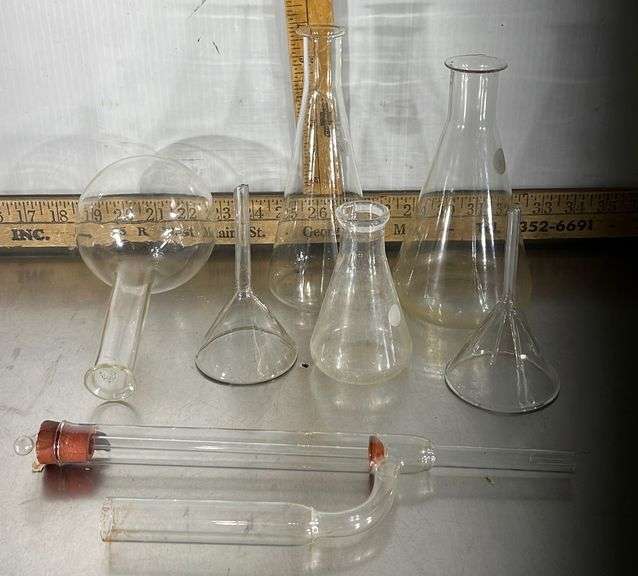
Where is `flask`? The image size is (638, 576). flask is located at coordinates (256, 363).